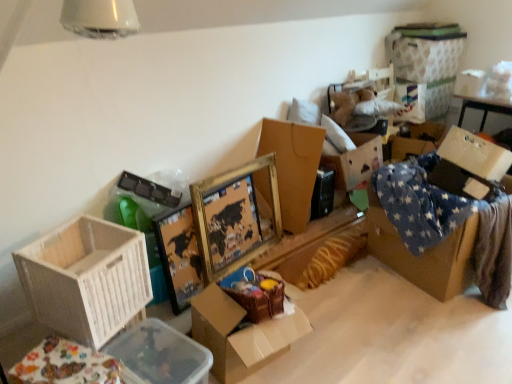
Question: Considering their positions, is clear plastic container at lower left, the 1th storage box viewed from the left, located in front of or behind gold/gilded picture frame at center?

Choices:
 (A) front
 (B) behind

Answer: (A)

Question: Considering the positions of point (204, 364) and point (195, 196), is point (204, 364) closer or farther from the camera than point (195, 196)?

Choices:
 (A) farther
 (B) closer

Answer: (B)

Question: Which object is positioned closest to the gold/gilded picture frame at center?

Choices:
 (A) white wood crate at lower left, the 1th box in the front-to-back sequence
 (B) gold cardboard box at center, acting as the 1th box starting from the back
 (C) white fabric storage box at upper right, which appears as the 3th storage box when ordered from the bottom
 (D) cardboard box at center, the second box viewed from the front
 (E) brown cardboard box at center, the 2th storage box in the back-to-front sequence

Answer: (B)

Question: Estimate the real-world distances between objects in this image. Which object is farther from the gold cardboard box at center, arranged as the 3th box when viewed from the front?

Choices:
 (A) white cardboard box at upper right
 (B) gold/gilded picture frame at center
 (C) white fabric storage box at upper right, which appears as the first storage box when viewed from the back
 (D) brown cardboard box at center, acting as the 2th storage box starting from the front
 (E) white wood crate at lower left, which is the third box in back-to-front order

Answer: (C)